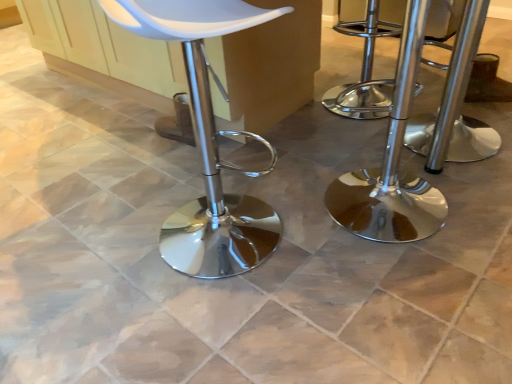
Find the location of a particular element. vacant region to the left of polished chrome stool at center, which is the 2th stool from left to right is located at coordinates (368, 140).